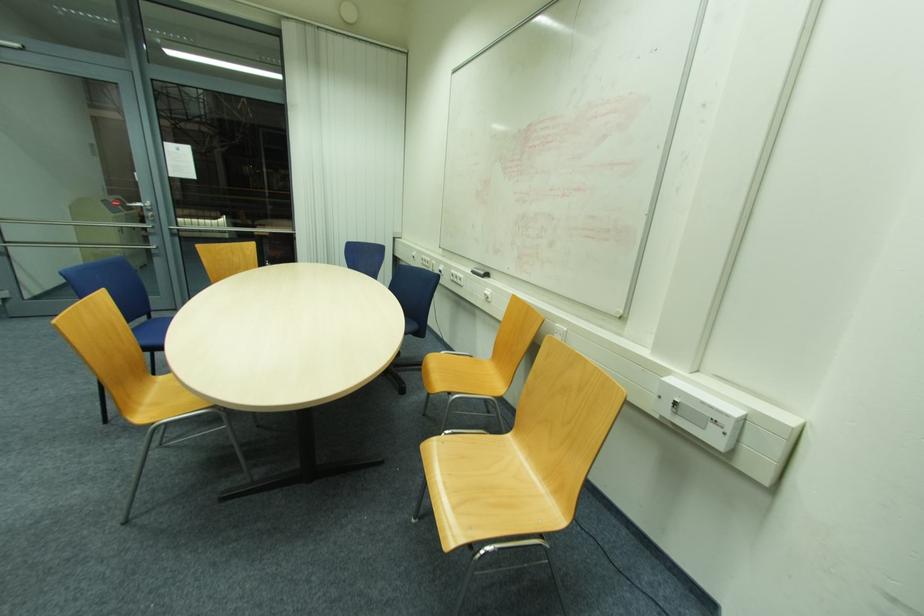
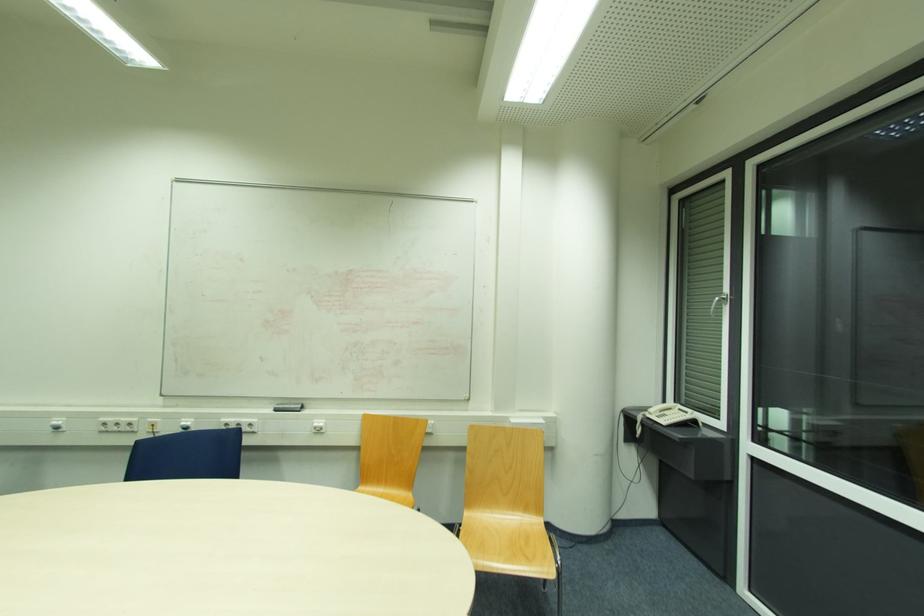
Locate, in the second image, the point that corresponds to (x=475, y=273) in the first image.

(276, 411)